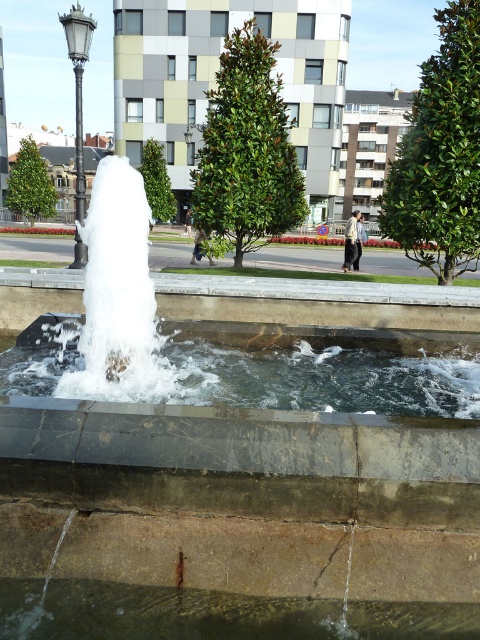
You are standing in the urban area and want to take a photo of the clear water at center without the polished metal lamp post at upper left appearing in the frame. Which direction should you move to achieve this?

Result: Move forward towards the clear water at center. Since the clear water at center is in front of the polished metal lamp post at upper left, moving closer to it will obscure the lamp post behind it.

You are standing in the urban setting and want to locate the clear water at center. From your position, which direction should you look relative to the polished metal lamp post at upper left?

The clear water at center is located to the right of the polished metal lamp post at upper left, so you should look to the right of the polished metal lamp post at upper left to find it.